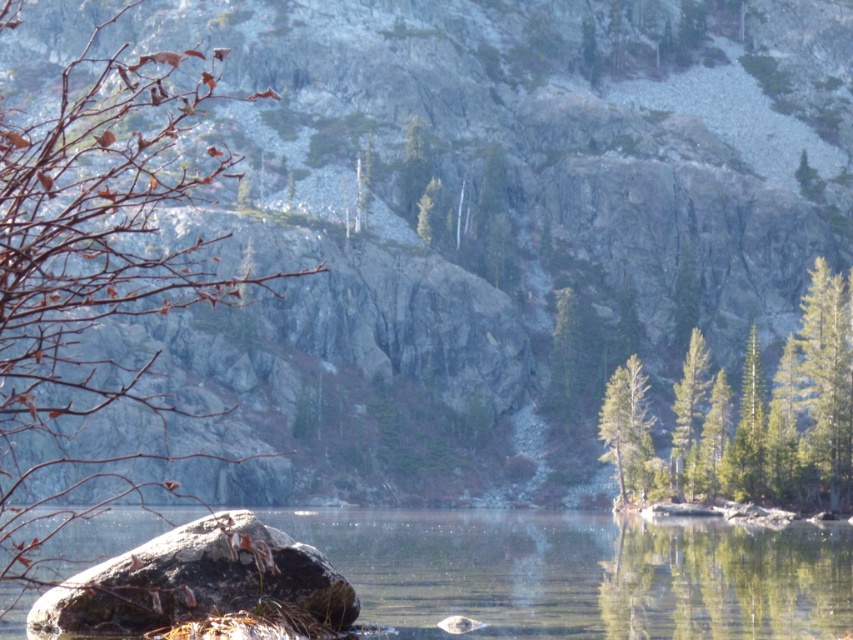
Question: Does green matte tree at right appear under green matte tree at center-right?

Choices:
 (A) no
 (B) yes

Answer: (A)

Question: Estimate the real-world distances between objects in this image. Which object is closer to the smooth rock at lower left?

Choices:
 (A) smooth gray rock at lower left
 (B) brown leafy branch at left
 (C) green textured tree at center

Answer: (B)

Question: Estimate the real-world distances between objects in this image. Which object is farther from the smooth gray rock at lower left?

Choices:
 (A) green textured pine tree at center-right
 (B) brown leafy branch at left

Answer: (A)

Question: Where is smooth rock at lower left located in relation to green matte tree at center-right in the image?

Choices:
 (A) above
 (B) below

Answer: (B)

Question: Among these objects, which one is farthest from the camera?

Choices:
 (A) green textured tree at center
 (B) brown leafy branch at left
 (C) smooth rock at lower left
 (D) green textured pine tree at center-right

Answer: (A)

Question: Does green textured trees at center have a smaller size compared to green textured pine tree at center-right?

Choices:
 (A) no
 (B) yes

Answer: (A)